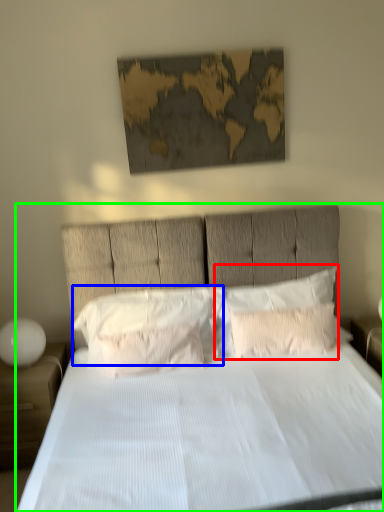
Question: Which object is the closest to the pillow (highlighted by a red box)? Choose among these: pillow (highlighted by a blue box) or bed (highlighted by a green box).

Choices:
 (A) pillow
 (B) bed

Answer: (A)